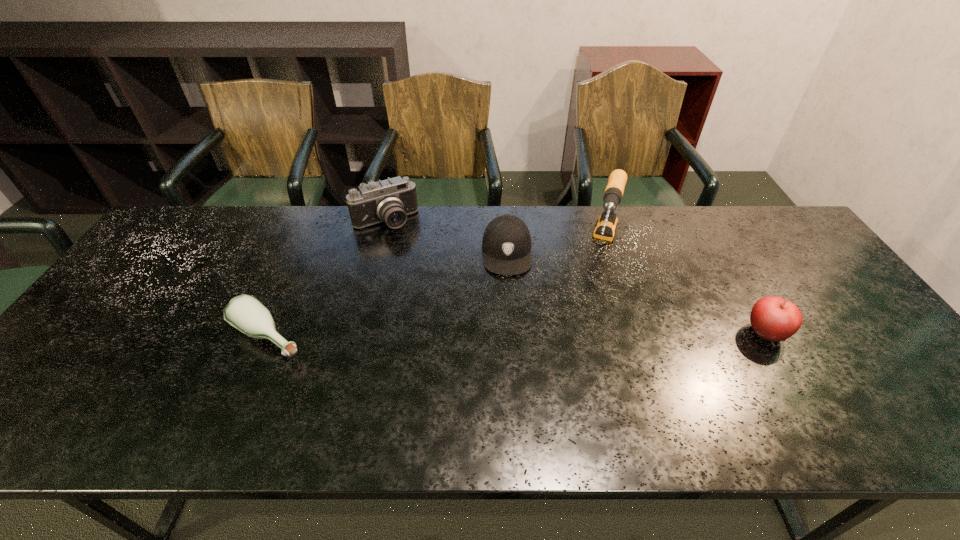
Locate an element on the screen. The height and width of the screenshot is (540, 960). bottle is located at coordinates (246, 313).

Find the location of a particular element. The width and height of the screenshot is (960, 540). the leftmost object is located at coordinates (246, 313).

Locate an element on the screen. This screenshot has width=960, height=540. the rightmost object is located at coordinates (774, 319).

Find the location of a particular element. Image resolution: width=960 pixels, height=540 pixels. cap is located at coordinates (506, 242).

Locate an element on the screen. The height and width of the screenshot is (540, 960). the tallest object is located at coordinates (606, 225).

I want to click on drill, so click(x=606, y=225).

Find the location of `the second tallest object`. the second tallest object is located at coordinates (390, 201).

Locate an element on the screen. The width and height of the screenshot is (960, 540). camera is located at coordinates (390, 201).

Where is `vacant space located on the right of the shortest object`? The height and width of the screenshot is (540, 960). vacant space located on the right of the shortest object is located at coordinates (390, 337).

The height and width of the screenshot is (540, 960). In order to click on blank area located 0.330m on the left of the rightmost object in this screenshot , I will do `click(614, 333)`.